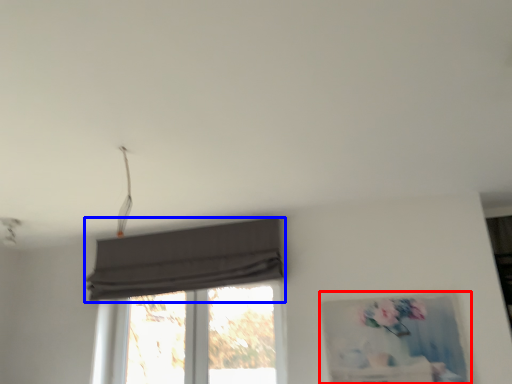
Question: Which object is further to the camera taking this photo, picture frame (highlighted by a red box) or curtain (highlighted by a blue box)?

Choices:
 (A) picture frame
 (B) curtain

Answer: (B)